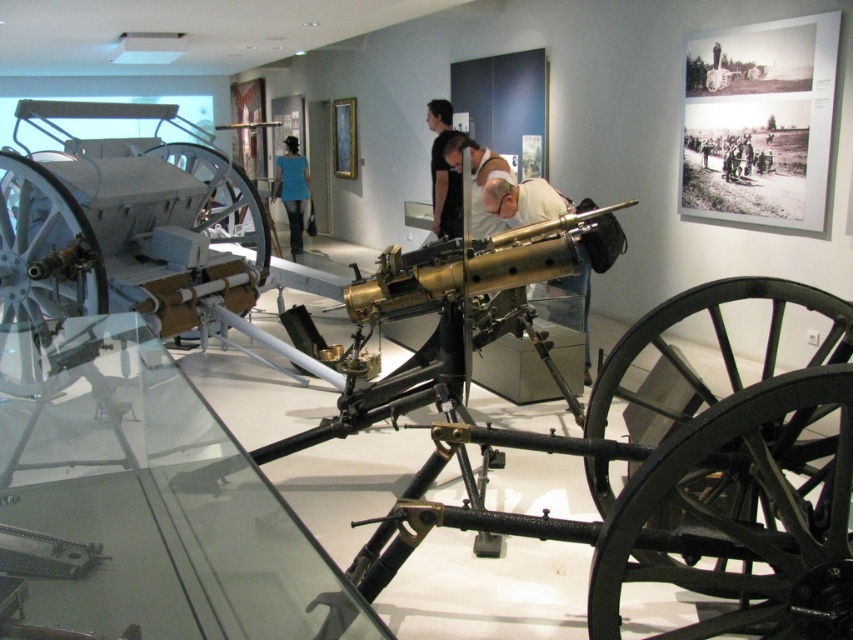
Where is `transparent glass table at center`? transparent glass table at center is located at coordinates (152, 508).

The width and height of the screenshot is (853, 640). What do you see at coordinates (152, 508) in the screenshot?
I see `transparent glass table at center` at bounding box center [152, 508].

Is point (55, 556) in front of point (560, 282)?

That is True.

Locate an element on the screen. The height and width of the screenshot is (640, 853). transparent glass table at center is located at coordinates (152, 508).

Is brown leather jacket at center above blue fabric shirt at center?

No, brown leather jacket at center is not above blue fabric shirt at center.

Does brown leather jacket at center come in front of blue fabric shirt at center?

Yes, brown leather jacket at center is closer to the viewer.

Describe the element at coordinates (734, 150) in the screenshot. Image resolution: width=853 pixels, height=640 pixels. I see `brown leather jacket at center` at that location.

Where is `brown leather jacket at center`? This screenshot has width=853, height=640. brown leather jacket at center is located at coordinates (734, 150).

Is black matte shirt at center taller than brown leather jacket at center?

Indeed, black matte shirt at center has a greater height compared to brown leather jacket at center.

Does black matte shirt at center have a larger size compared to brown leather jacket at center?

Correct, black matte shirt at center is larger in size than brown leather jacket at center.

Which is behind, point (453, 172) or point (715, 141)?

The point (453, 172) is behind.

Where is `black matte shirt at center`? black matte shirt at center is located at coordinates (444, 173).